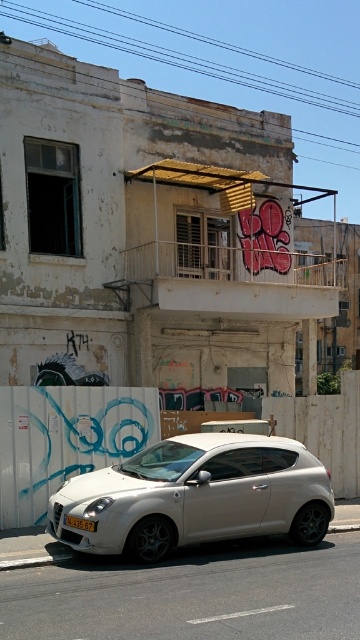
Question: From the image, what is the correct spatial relationship of white matte hatchback at center in relation to yellow matte license plate at lower center?

Choices:
 (A) left
 (B) right

Answer: (B)

Question: Observing the image, what is the correct spatial positioning of white matte hatchback at center in reference to yellow matte license plate at lower center?

Choices:
 (A) right
 (B) left

Answer: (A)

Question: Can you confirm if white matte hatchback at center is positioned to the left of yellow matte license plate at lower center?

Choices:
 (A) yes
 (B) no

Answer: (B)

Question: Which object appears farthest from the camera in this image?

Choices:
 (A) white matte hatchback at center
 (B) yellow matte license plate at lower center

Answer: (B)